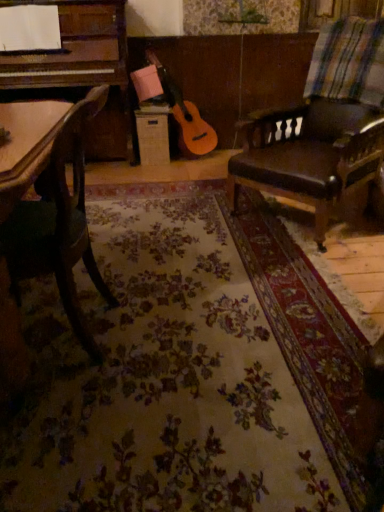
Question: Could you tell me if green fabric chair at left, the first chair positioned from the left, is turned towards leather cushioned chair at right, which appears as the first chair when viewed from the back?

Choices:
 (A) no
 (B) yes

Answer: (A)

Question: Is leather cushioned chair at right, which is the second chair in front-to-back order, located within green fabric chair at left, the first chair positioned from the left?

Choices:
 (A) no
 (B) yes

Answer: (A)

Question: From the image's perspective, is green fabric chair at left, which is the second chair from right to left, above leather cushioned chair at right, the second chair positioned from the left?

Choices:
 (A) yes
 (B) no

Answer: (B)

Question: Is green fabric chair at left, which is the second chair from right to left, turned away from leather cushioned chair at right, arranged as the 1th chair when viewed from the right?

Choices:
 (A) no
 (B) yes

Answer: (A)

Question: Is green fabric chair at left, the second chair from the back, not close to leather cushioned chair at right, arranged as the 1th chair when viewed from the right?

Choices:
 (A) yes
 (B) no

Answer: (A)

Question: Does green fabric chair at left, which is counted as the 1th chair, starting from the front, lie in front of leather cushioned chair at right, which is the second chair in front-to-back order?

Choices:
 (A) yes
 (B) no

Answer: (A)

Question: Is leather cushioned chair at right, arranged as the 1th chair when viewed from the right, in contact with green fabric chair at left, the first chair positioned from the left?

Choices:
 (A) yes
 (B) no

Answer: (B)

Question: Is leather cushioned chair at right, which is the second chair in front-to-back order, not inside green fabric chair at left, the first chair positioned from the left?

Choices:
 (A) no
 (B) yes

Answer: (B)

Question: From the image's perspective, is leather cushioned chair at right, the second chair positioned from the left, beneath green fabric chair at left, which is the second chair from right to left?

Choices:
 (A) yes
 (B) no

Answer: (B)

Question: Does leather cushioned chair at right, which appears as the first chair when viewed from the back, have a greater width compared to green fabric chair at left, which is counted as the 1th chair, starting from the front?

Choices:
 (A) no
 (B) yes

Answer: (B)

Question: Is leather cushioned chair at right, the second chair positioned from the left, taller than green fabric chair at left, which is the second chair from right to left?

Choices:
 (A) no
 (B) yes

Answer: (B)

Question: Does leather cushioned chair at right, which is the second chair in front-to-back order, have a lesser width compared to green fabric chair at left, the second chair from the back?

Choices:
 (A) yes
 (B) no

Answer: (B)

Question: Is leather cushioned chair at right, the second chair positioned from the left, taller than multicolored woven blanket at upper right?

Choices:
 (A) no
 (B) yes

Answer: (B)